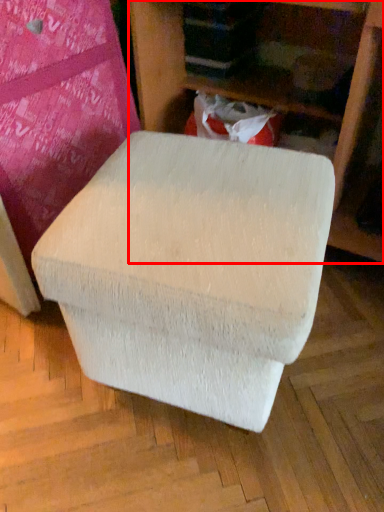
Question: Considering the relative positions of furniture (annotated by the red box) and bean bag chair in the image provided, where is furniture (annotated by the red box) located with respect to the staircase?

Choices:
 (A) right
 (B) left

Answer: (A)